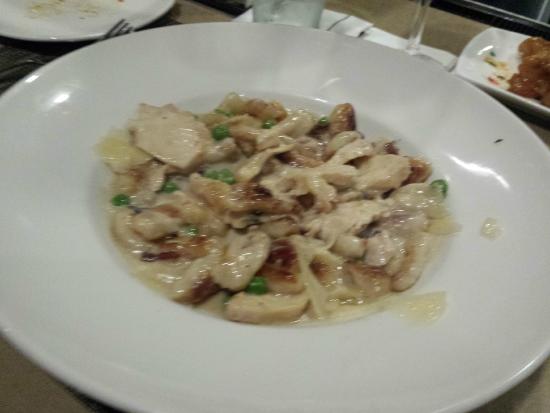
The image size is (550, 413). Identify the location of stem of glass. (419, 20).